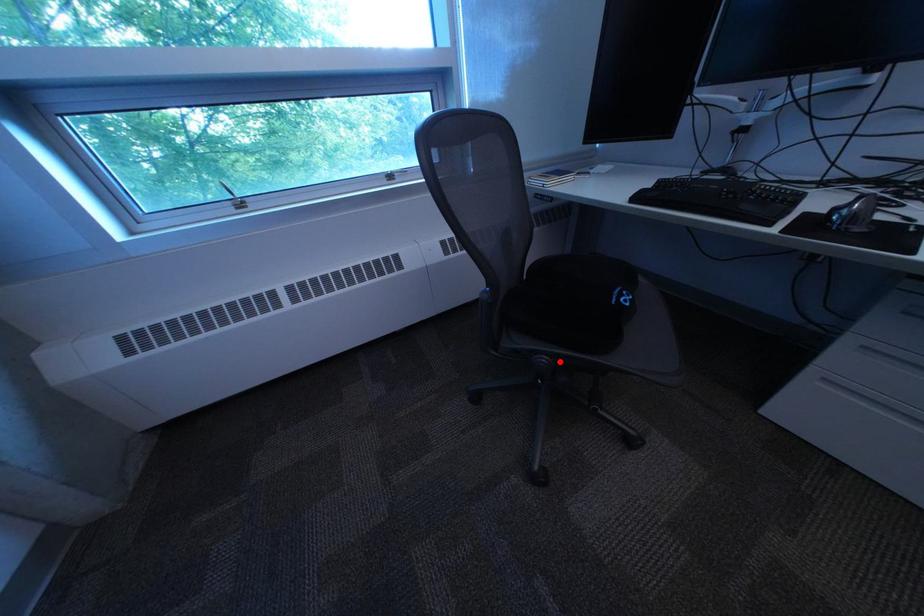
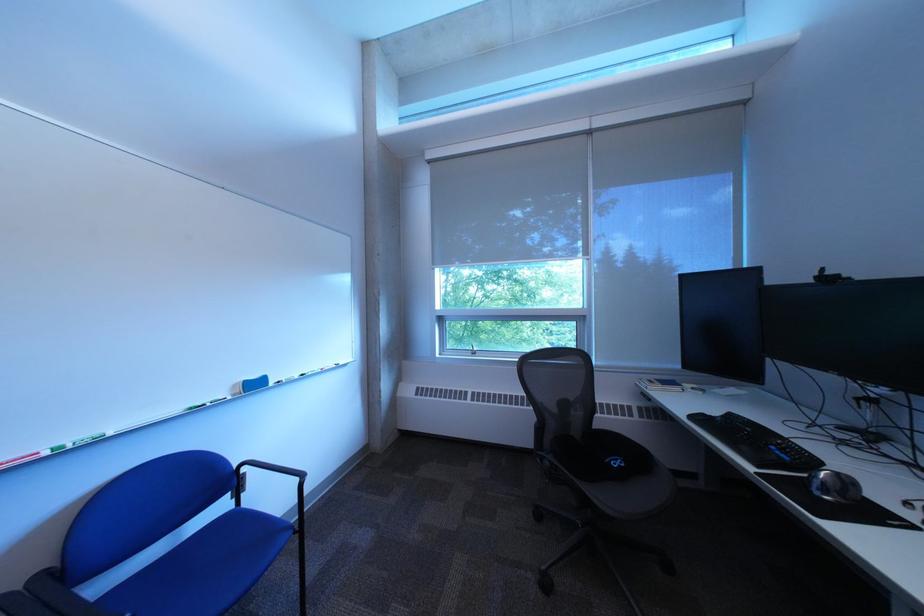
The point at the highlighted location is marked in the first image. Where is the corresponding point in the second image?

(563, 464)